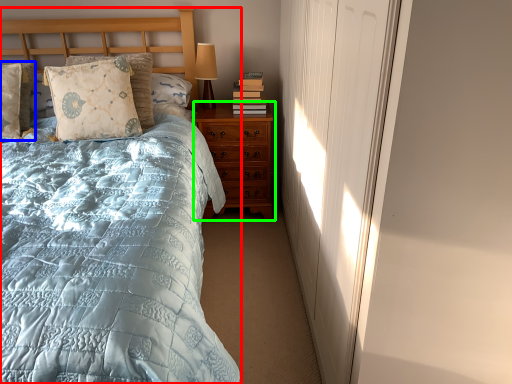
Question: Estimate the real-world distances between objects in this image. Which object is farther from bed (highlighted by a red box), pillow (highlighted by a blue box) or nightstand (highlighted by a green box)?

Choices:
 (A) pillow
 (B) nightstand

Answer: (A)